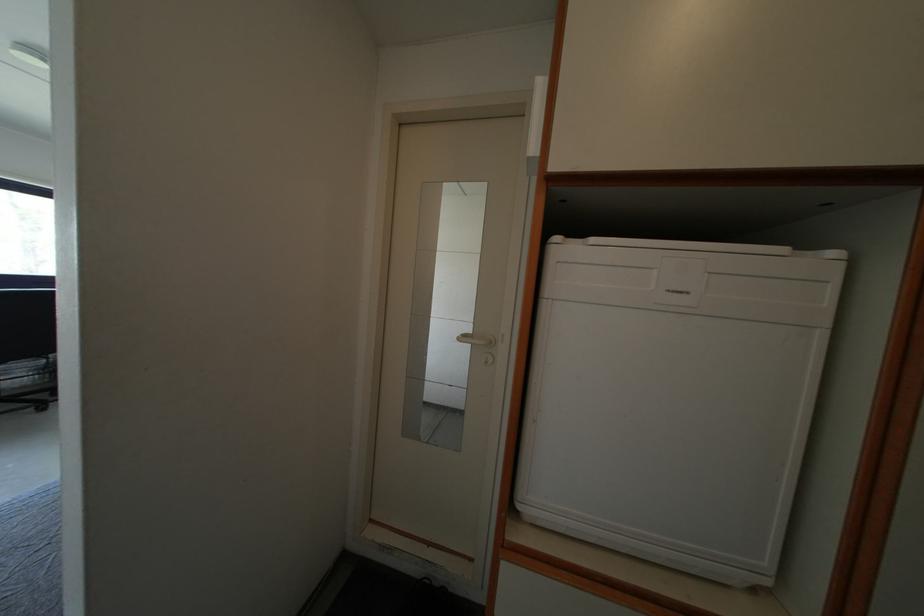
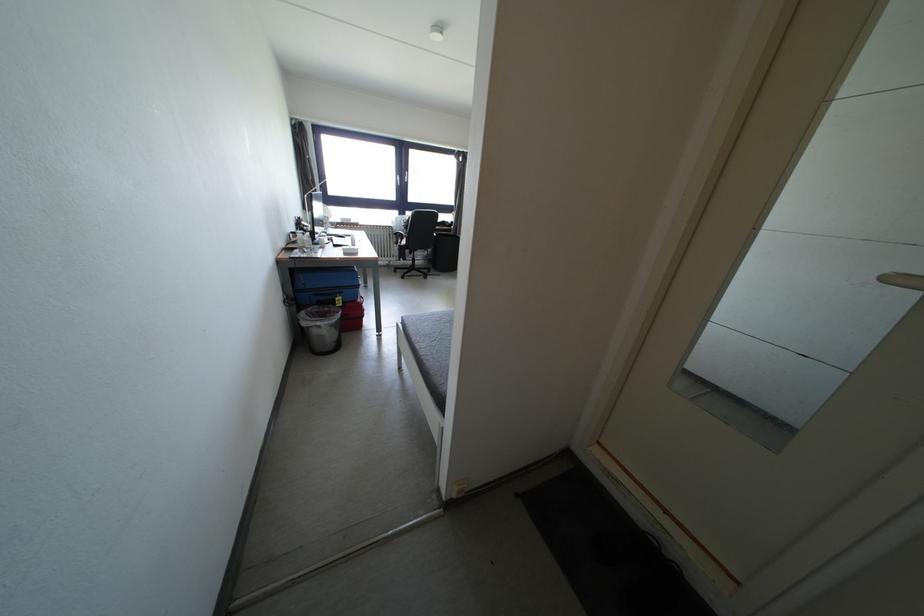
Based on the continuous images, in which direction is the camera rotating?

The camera's rotation is toward left-down.